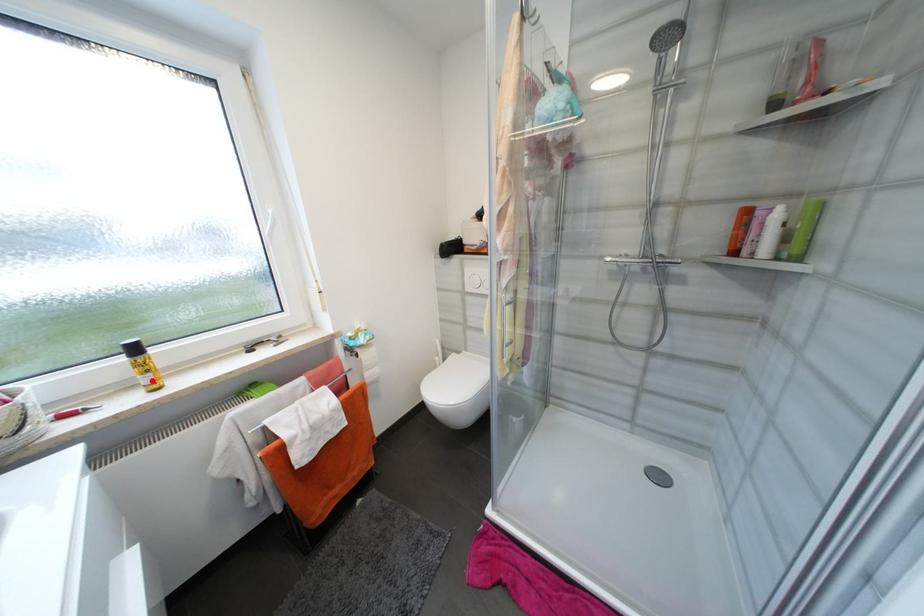
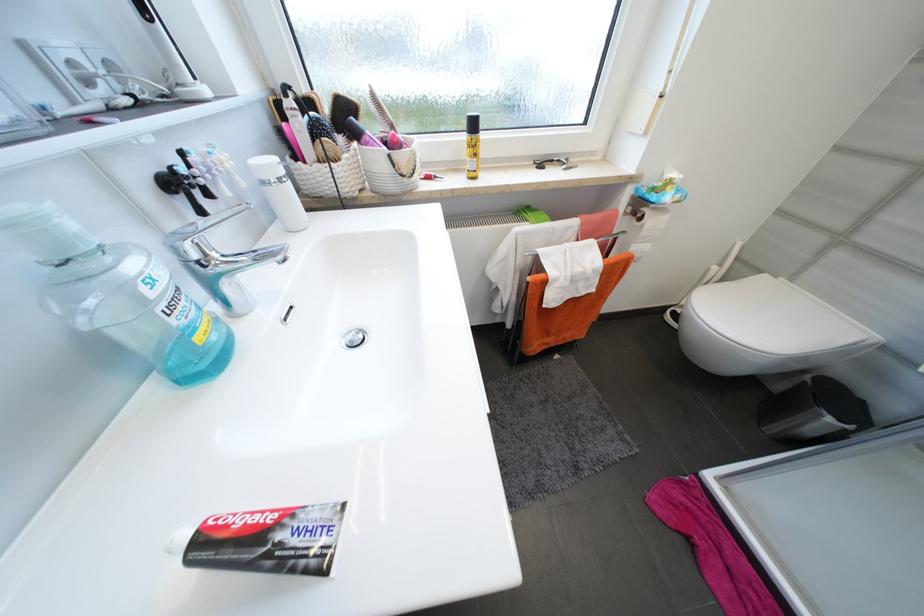
In the second image, find the point that corresponds to the highlighted location in the first image.

(477, 166)